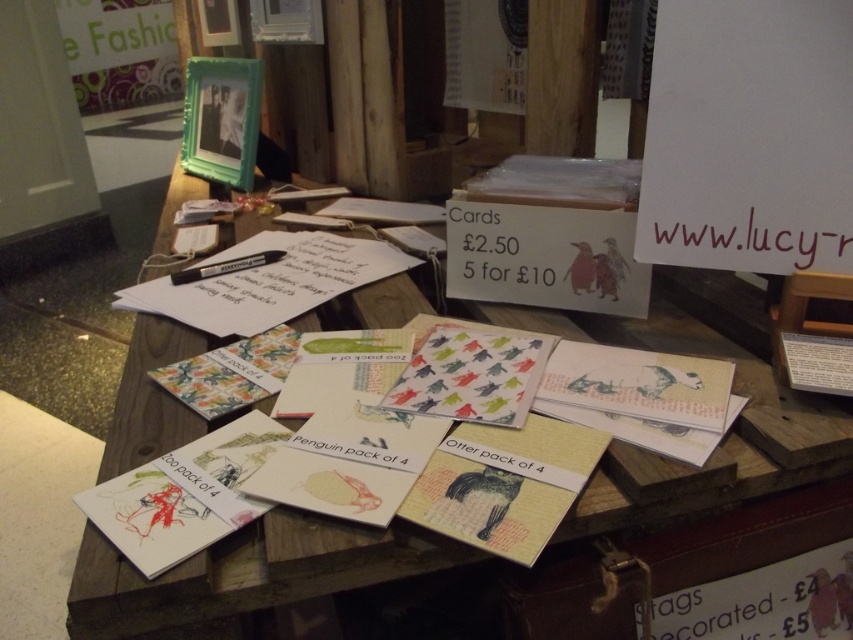
Question: Which point is farther from the camera taking this photo?

Choices:
 (A) (415, 323)
 (B) (734, 250)

Answer: (A)

Question: Which point appears farthest from the camera in this image?

Choices:
 (A) (833, 192)
 (B) (412, 403)
 (C) (204, 618)

Answer: (A)

Question: Is wooden cards at center wider than matte paper card at center?

Choices:
 (A) yes
 (B) no

Answer: (A)

Question: Does white paper at upper right lie in front of matte paper card at center?

Choices:
 (A) yes
 (B) no

Answer: (B)

Question: Does wooden cards at center appear on the left side of white paper at upper right?

Choices:
 (A) yes
 (B) no

Answer: (A)

Question: Estimate the real-world distances between objects in this image. Which object is closer to the wooden cards at center?

Choices:
 (A) white paper at upper right
 (B) matte paper card at center

Answer: (B)